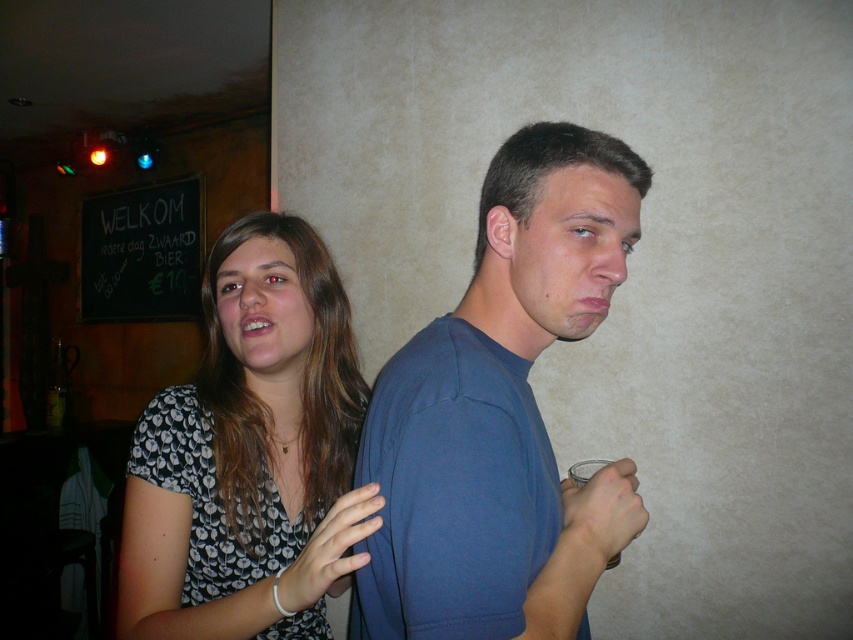
Question: Among these points, which one is nearest to the camera?

Choices:
 (A) coord(537,198)
 (B) coord(119,602)

Answer: (A)

Question: Does blue cotton t-shirt at center appear on the right side of floral print blouse at center?

Choices:
 (A) yes
 (B) no

Answer: (A)

Question: Which point is closer to the camera?

Choices:
 (A) (186, 541)
 (B) (502, 358)

Answer: (B)

Question: Which object is closer to the camera taking this photo?

Choices:
 (A) blue cotton t-shirt at center
 (B) floral print blouse at center

Answer: (A)

Question: Is blue cotton t-shirt at center above floral print blouse at center?

Choices:
 (A) yes
 (B) no

Answer: (A)

Question: Does blue cotton t-shirt at center have a lesser width compared to floral print blouse at center?

Choices:
 (A) no
 (B) yes

Answer: (B)